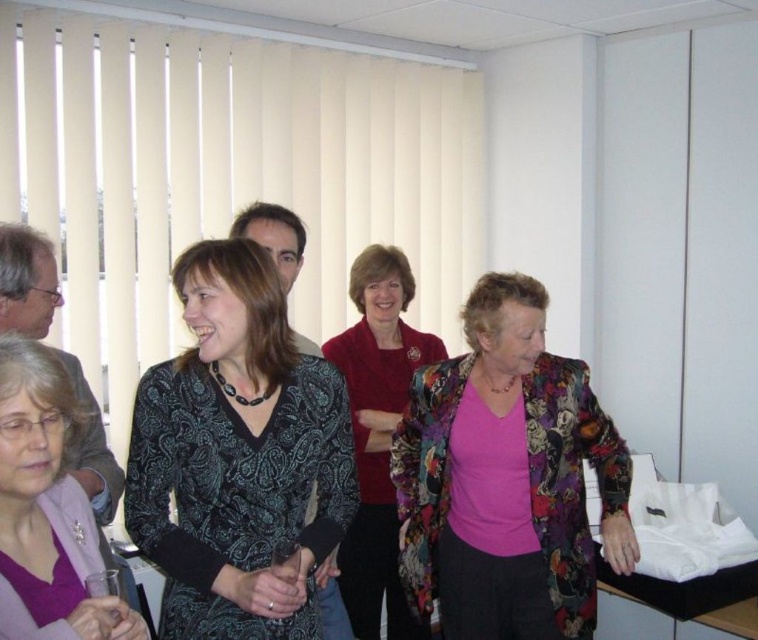
You are a photographer standing at the camera position. You want to take a closeup shot of the patterned fabric dress at center. What is the minimum distance you need to move forward to get the dress into focus?

The patterned fabric dress at center is 2.77 meters away from the camera. To take a closeup shot, you need to move forward until you are within the minimum focusing distance required by your camera lens. However, without knowing the lens specifications, it is impossible to determine the exact distance needed.